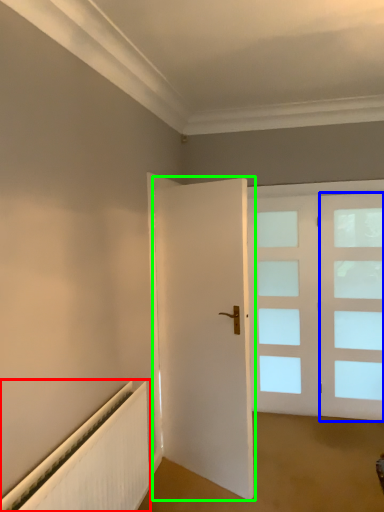
Question: Based on their relative distances, which object is nearer to radiator (highlighted by a red box)? Choose from window (highlighted by a blue box) and door (highlighted by a green box).

Choices:
 (A) window
 (B) door

Answer: (B)